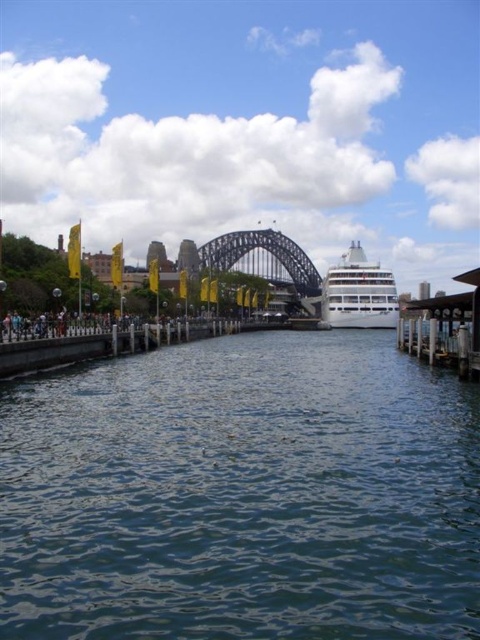
Question: Can you confirm if blue water at center is thinner than white glossy cruise ship at center?

Choices:
 (A) yes
 (B) no

Answer: (B)

Question: Which point appears closest to the camera in this image?

Choices:
 (A) (393, 288)
 (B) (308, 273)

Answer: (A)

Question: Which object is positioned farthest from the white glossy cruise ship at center?

Choices:
 (A) blue water at center
 (B) dark gray steel bridge at center

Answer: (A)

Question: Is blue water at center bigger than dark gray steel bridge at center?

Choices:
 (A) yes
 (B) no

Answer: (B)

Question: Among these points, which one is farthest from the camera?

Choices:
 (A) (340, 486)
 (B) (322, 284)

Answer: (B)

Question: Is blue water at center closer to the viewer compared to dark gray steel bridge at center?

Choices:
 (A) no
 (B) yes

Answer: (B)